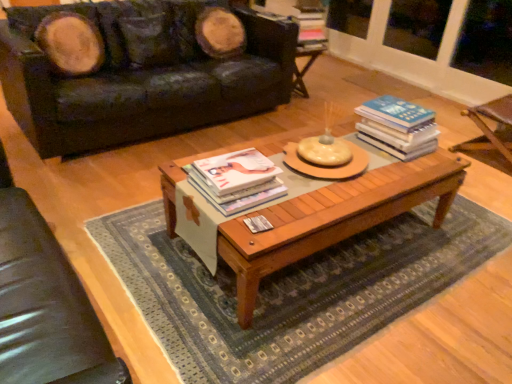
The width and height of the screenshot is (512, 384). In order to click on free space in front of matte white book at center, the first book when ordered from left to right in this screenshot , I will do `click(249, 227)`.